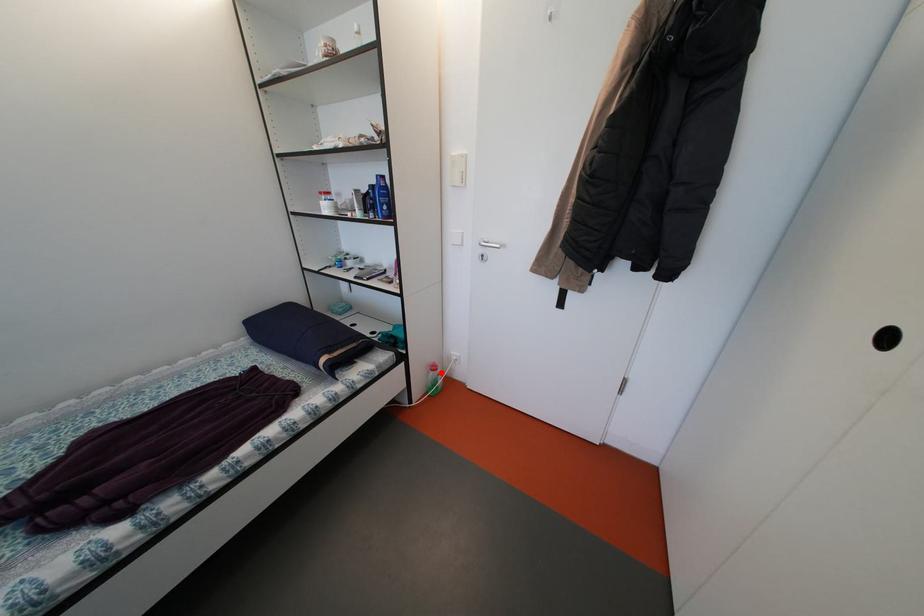
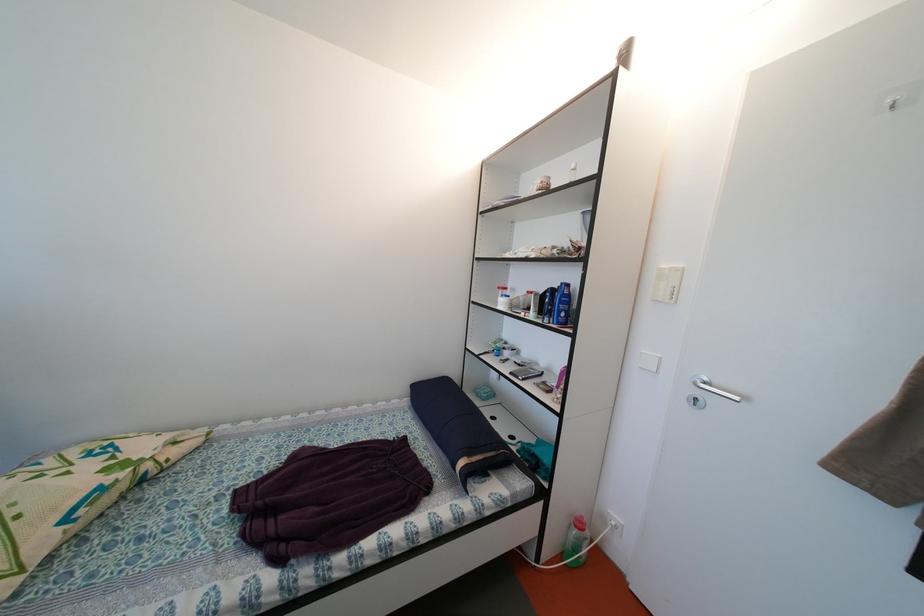
Find the pixel in the second image that matches the highlighted location in the first image.

(587, 530)